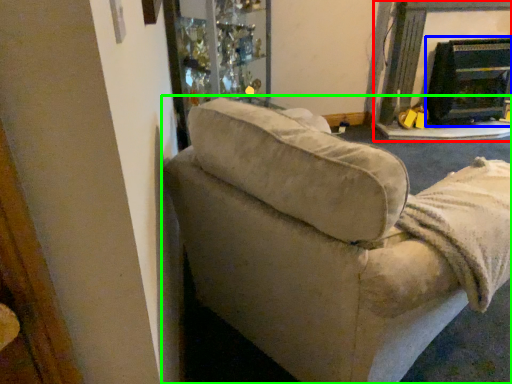
Question: Considering the real-world distances, which object is closest to fireplace (highlighted by a red box)? fireplace (highlighted by a blue box) or studio couch (highlighted by a green box).

Choices:
 (A) fireplace
 (B) studio couch

Answer: (A)